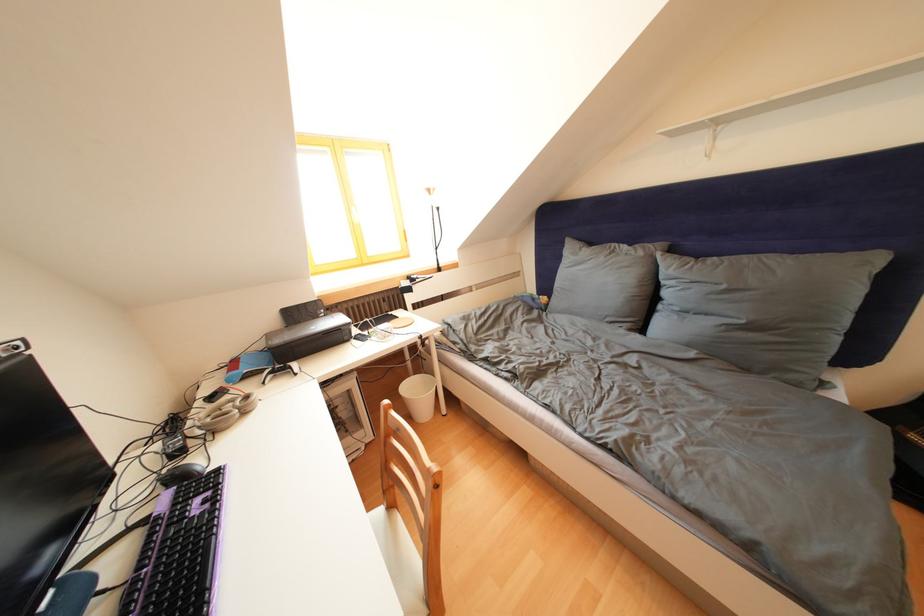
Where would you lift the printer lid? Please return your answer as a coordinate pair (x, y).

(308, 337)